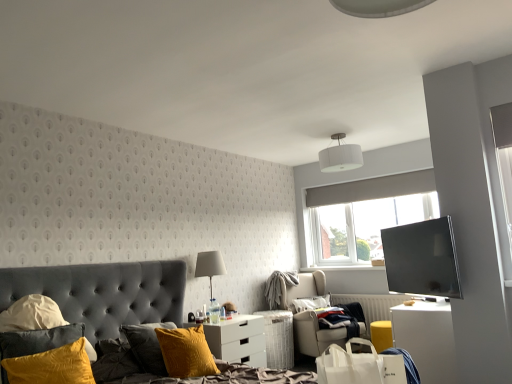
Question: Is white glossy nightstand at lower center outside of velvet grey bed at lower left?

Choices:
 (A) yes
 (B) no

Answer: (A)

Question: Does white glossy nightstand at lower center turn towards velvet grey bed at lower left?

Choices:
 (A) yes
 (B) no

Answer: (B)

Question: From a real-world perspective, is white glossy nightstand at lower center physically above velvet grey bed at lower left?

Choices:
 (A) yes
 (B) no

Answer: (B)

Question: Is white glossy nightstand at lower center directly adjacent to velvet grey bed at lower left?

Choices:
 (A) no
 (B) yes

Answer: (A)

Question: From the image's perspective, is white glossy nightstand at lower center over velvet grey bed at lower left?

Choices:
 (A) no
 (B) yes

Answer: (A)

Question: Is white glossy nightstand at lower center bigger or smaller than beige fabric chair at center?

Choices:
 (A) big
 (B) small

Answer: (B)

Question: Do you think white glossy nightstand at lower center is within beige fabric chair at center, or outside of it?

Choices:
 (A) outside
 (B) inside

Answer: (A)

Question: Considering the relative positions of white glossy nightstand at lower center and beige fabric chair at center in the image provided, is white glossy nightstand at lower center to the left or to the right of beige fabric chair at center?

Choices:
 (A) right
 (B) left

Answer: (B)

Question: Is white glossy nightstand at lower center wider or thinner than beige fabric chair at center?

Choices:
 (A) thin
 (B) wide

Answer: (A)

Question: From a real-world perspective, is white glossy desk at lower right positioned above or below white glossy nightstand at lower center?

Choices:
 (A) above
 (B) below

Answer: (B)

Question: In the image, is white glossy desk at lower right on the left side or the right side of white glossy nightstand at lower center?

Choices:
 (A) left
 (B) right

Answer: (B)

Question: Would you say white glossy desk at lower right is inside or outside white glossy nightstand at lower center?

Choices:
 (A) inside
 (B) outside

Answer: (B)

Question: From the image's perspective, is white glossy desk at lower right positioned above or below white glossy nightstand at lower center?

Choices:
 (A) below
 (B) above

Answer: (B)

Question: Choose the correct answer: Is white glossy desk at lower right inside translucent glass bottle at center or outside it?

Choices:
 (A) outside
 (B) inside

Answer: (A)

Question: From the image's perspective, is white glossy desk at lower right above or below translucent glass bottle at center?

Choices:
 (A) above
 (B) below

Answer: (B)